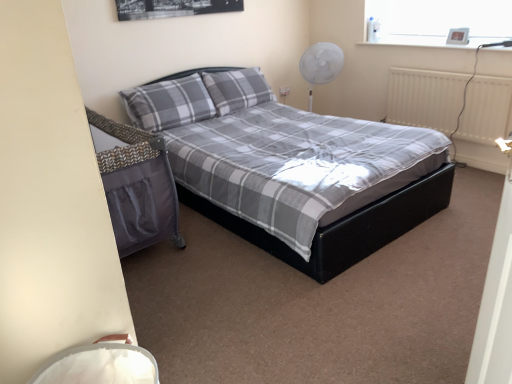
What do you see at coordinates (344, 225) in the screenshot?
I see `matte black bed at center` at bounding box center [344, 225].

Locate an element on the screen. metallic digital clock at upper right is located at coordinates (458, 36).

Describe the element at coordinates (320, 65) in the screenshot. I see `white plastic fan at upper right` at that location.

The height and width of the screenshot is (384, 512). I want to click on white plastic fan at upper right, so click(320, 65).

Find the location of a particular element. white matte radiator at right is located at coordinates (425, 98).

This screenshot has width=512, height=384. I want to click on matte black bed at center, so click(x=344, y=225).

The image size is (512, 384). I want to click on the 2nd pillow counting from the left side of the white plastic fan at upper right, so click(x=169, y=103).

From the picture: Is gray plaid pillow at center, arranged as the second pillow when viewed from the right, behind white plastic fan at upper right?

No, gray plaid pillow at center, arranged as the second pillow when viewed from the right, is closer to the camera.

Considering the sizes of objects gray plaid pillow at center, the 1th pillow from the left, and white plastic fan at upper right in the image provided, who is thinner, gray plaid pillow at center, the 1th pillow from the left, or white plastic fan at upper right?

gray plaid pillow at center, the 1th pillow from the left, is thinner.

Between gray plaid pillow at center, arranged as the second pillow when viewed from the right, and white plastic fan at upper right, which one has larger size?

With larger size is white plastic fan at upper right.

Is matte black bed at center inside the boundaries of white matte radiator at right, or outside?

matte black bed at center cannot be found inside white matte radiator at right.

Locate an element on the screen. bed below the white matte radiator at right (from a real-world perspective) is located at coordinates (344, 225).

From the image's perspective, is matte black bed at center positioned above or below white matte radiator at right?

matte black bed at center is below white matte radiator at right.

From a real-world perspective, between matte black bed at center and white matte radiator at right, who is vertically lower?

In real-world perspective, matte black bed at center is lower.

Considering the relative positions of gray plaid pillow at center, which is the first pillow from right to left, and white matte radiator at right in the image provided, is gray plaid pillow at center, which is the first pillow from right to left, to the right of white matte radiator at right from the viewer's perspective?

In fact, gray plaid pillow at center, which is the first pillow from right to left, is to the left of white matte radiator at right.

You are a GUI agent. You are given a task and a screenshot of the screen. Output one action in this format:
    pyautogui.click(x=<x>, y=<y>)
    Task: Click on the radiator directly beneath the gray plaid pillow at center, which is the first pillow from right to left (from a real-world perspective)
    This screenshot has width=512, height=384.
    Given the screenshot: What is the action you would take?
    pyautogui.click(x=425, y=98)

From a real-world perspective, is gray plaid pillow at center, the second pillow from the left, located beneath white matte radiator at right?

Incorrect, from a real-world perspective, gray plaid pillow at center, the second pillow from the left, is higher than white matte radiator at right.

Would you say gray plaid pillow at center, which is the first pillow from right to left, is inside or outside white matte radiator at right?

gray plaid pillow at center, which is the first pillow from right to left, is spatially situated outside white matte radiator at right.

Image resolution: width=512 pixels, height=384 pixels. Find the location of `pillow that is the 1st one below the metallic digital clock at upper right (from a real-world perspective)`. pillow that is the 1st one below the metallic digital clock at upper right (from a real-world perspective) is located at coordinates (237, 89).

From their relative heights in the image, would you say metallic digital clock at upper right is taller or shorter than gray plaid pillow at center, which is the first pillow from right to left?

Considering their sizes, metallic digital clock at upper right has less height than gray plaid pillow at center, which is the first pillow from right to left.

Based on the photo, from the image's perspective, would you say metallic digital clock at upper right is shown under gray plaid pillow at center, which is the first pillow from right to left?

No, from the image's perspective, metallic digital clock at upper right is not beneath gray plaid pillow at center, which is the first pillow from right to left.

Is point (465, 39) in front of point (249, 80)?

Yes.

Is white plastic fan at upper right shorter than matte black bed at center?

Indeed, white plastic fan at upper right has a lesser height compared to matte black bed at center.

What's the angular difference between white plastic fan at upper right and matte black bed at center's facing directions?

The angular difference between white plastic fan at upper right and matte black bed at center is 0.292 degrees.

Is there a large distance between white plastic fan at upper right and matte black bed at center?

That's right, there is a large distance between white plastic fan at upper right and matte black bed at center.

Looking at this image, considering the relative sizes of gray plaid pillow at center, the second pillow from the left, and metallic digital clock at upper right in the image provided, is gray plaid pillow at center, the second pillow from the left, wider than metallic digital clock at upper right?

Correct, the width of gray plaid pillow at center, the second pillow from the left, exceeds that of metallic digital clock at upper right.

Considering the relative positions of gray plaid pillow at center, which is the first pillow from right to left, and metallic digital clock at upper right in the image provided, is gray plaid pillow at center, which is the first pillow from right to left, in front of metallic digital clock at upper right?

No, it is not.

From the image's perspective, relative to metallic digital clock at upper right, is gray plaid pillow at center, which is the first pillow from right to left, above or below?

From the image's perspective, gray plaid pillow at center, which is the first pillow from right to left, appears below metallic digital clock at upper right.

Is white plastic fan at upper right located outside gray plaid pillow at center, which is the first pillow from right to left?

That's correct, white plastic fan at upper right is outside of gray plaid pillow at center, which is the first pillow from right to left.

From a real-world perspective, is white plastic fan at upper right physically below gray plaid pillow at center, which is the first pillow from right to left?

Correct, in the physical world, white plastic fan at upper right is lower than gray plaid pillow at center, which is the first pillow from right to left.

Between white plastic fan at upper right and gray plaid pillow at center, the second pillow from the left, which one appears on the left side from the viewer's perspective?

From the viewer's perspective, gray plaid pillow at center, the second pillow from the left, appears more on the left side.

Is white plastic fan at upper right looking in the opposite direction of gray plaid pillow at center, the second pillow from the left?

No, white plastic fan at upper right is not facing away from gray plaid pillow at center, the second pillow from the left.

You are a GUI agent. You are given a task and a screenshot of the screen. Output one action in this format:
    pyautogui.click(x=<x>, y=<y>)
    Task: Click on the fan located underneath the gray plaid pillow at center, the 1th pillow from the left (from a real-world perspective)
    Image resolution: width=512 pixels, height=384 pixels.
    Given the screenshot: What is the action you would take?
    click(320, 65)

Identify the location of radiator on the right of matte black bed at center. This screenshot has width=512, height=384. (425, 98).

Which object lies further to the anchor point gray plaid pillow at center, the second pillow from the left, matte black bed at center or white plastic fan at upper right?

matte black bed at center.

Estimate the real-world distances between objects in this image. Which object is closer to metallic digital clock at upper right, white plastic fan at upper right or gray plaid pillow at center, the second pillow from the left?

white plastic fan at upper right.

Which object lies further to the anchor point gray plaid pillow at center, the second pillow from the left, white matte radiator at right or metallic digital clock at upper right?

metallic digital clock at upper right lies further to gray plaid pillow at center, the second pillow from the left, than the other object.

Which object lies nearer to the anchor point white matte radiator at right, metallic digital clock at upper right or white plastic fan at upper right?

Among the two, metallic digital clock at upper right is located nearer to white matte radiator at right.

Considering their positions, is gray plaid pillow at center, which is the first pillow from right to left, positioned closer to gray plaid pillow at center, arranged as the second pillow when viewed from the right, than white plastic fan at upper right?

gray plaid pillow at center, which is the first pillow from right to left.

Which object lies nearer to the anchor point gray plaid pillow at center, which is the first pillow from right to left, gray plaid pillow at center, the 1th pillow from the left, or white matte radiator at right?

Based on the image, gray plaid pillow at center, the 1th pillow from the left, appears to be nearer to gray plaid pillow at center, which is the first pillow from right to left.

From the image, which object appears to be nearer to metallic digital clock at upper right, matte black bed at center or gray plaid pillow at center, arranged as the second pillow when viewed from the right?

matte black bed at center.

Estimate the real-world distances between objects in this image. Which object is closer to gray plaid pillow at center, the second pillow from the left, white matte radiator at right or gray plaid pillow at center, arranged as the second pillow when viewed from the right?

gray plaid pillow at center, arranged as the second pillow when viewed from the right, is positioned closer to the anchor gray plaid pillow at center, the second pillow from the left.

I want to click on picture frame between matte black bed at center and white plastic fan at upper right in the front-back direction, so click(x=458, y=36).

The height and width of the screenshot is (384, 512). Identify the location of pillow between gray plaid pillow at center, the 1th pillow from the left, and white matte radiator at right from left to right. (237, 89).

Find the location of `pillow located between gray plaid pillow at center, the 1th pillow from the left, and metallic digital clock at upper right in the left-right direction`. pillow located between gray plaid pillow at center, the 1th pillow from the left, and metallic digital clock at upper right in the left-right direction is located at coordinates (237, 89).

The image size is (512, 384). Identify the location of fan located between gray plaid pillow at center, the 1th pillow from the left, and white matte radiator at right in the left-right direction. (320, 65).